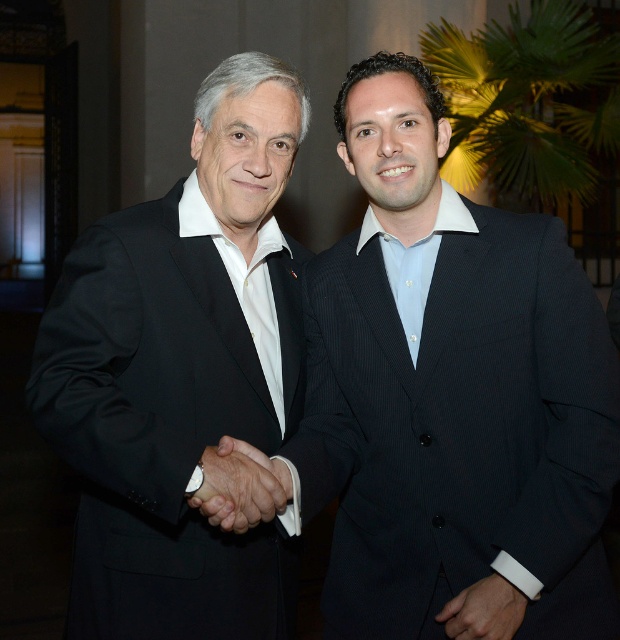
Question: Is the position of black pinstripe suit at center less distant than that of black matte hand at center?

Choices:
 (A) no
 (B) yes

Answer: (A)

Question: From the image, what is the correct spatial relationship of black matte suit at left in relation to white leather wristband at center?

Choices:
 (A) right
 (B) left

Answer: (B)

Question: Among these points, which one is farthest from the camera?

Choices:
 (A) (87, 390)
 (B) (484, 600)

Answer: (B)

Question: Which of the following is the closest to the observer?

Choices:
 (A) black matte suit at left
 (B) white leather wristband at center
 (C) black matte hand at center

Answer: (C)

Question: Is black pinstripe suit at center smaller than black matte hand at center?

Choices:
 (A) no
 (B) yes

Answer: (A)

Question: Which of these objects is positioned closest to the black pinstripe suit at center?

Choices:
 (A) white leather wristband at center
 (B) black matte suit at left

Answer: (B)